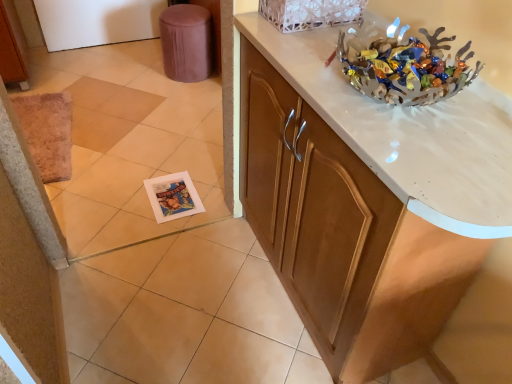
Locate an element on the screen. vacant point above white marble countertop at upper right (from a real-world perspective) is located at coordinates (388, 103).